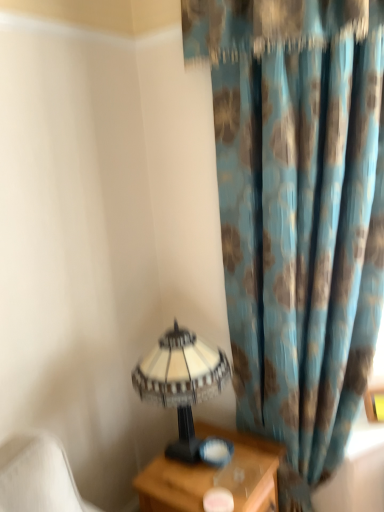
You are a GUI agent. You are given a task and a screenshot of the screen. Output one action in this format:
    pyautogui.click(x=<x>, y=<y>)
    Task: Click on the white textured lampshade at lower left
    
    Given the screenshot: What is the action you would take?
    pyautogui.click(x=181, y=382)

Find the location of a particular element. The width and height of the screenshot is (384, 512). wooden nightstand at lower right is located at coordinates (214, 476).

The image size is (384, 512). Find the location of `white textured lampshade at lower left`. white textured lampshade at lower left is located at coordinates (181, 382).

Is point (369, 401) positioned in front of point (353, 417)?

No.

How different are the orientations of yellow matte picture frame at right and blue floral fabric curtain at right in degrees?

They differ by 41.7 degrees in their facing directions.

Is yellow matte picture frame at right far away from blue floral fabric curtain at right?

No, yellow matte picture frame at right is not far away from blue floral fabric curtain at right.

Find the location of a particular element. This screenshot has width=384, height=512. curtain positioned vertically above the yellow matte picture frame at right (from a real-world perspective) is located at coordinates (298, 208).

How different are the orientations of wooden nightstand at lower right and white textured lampshade at lower left in degrees?

There is a 0.937-degree angle between the facing directions of wooden nightstand at lower right and white textured lampshade at lower left.

In terms of height, does wooden nightstand at lower right look taller or shorter compared to white textured lampshade at lower left?

In the image, wooden nightstand at lower right appears to be shorter than white textured lampshade at lower left.

Which point is more distant from viewer, (262,490) or (173,380)?

The point (262,490) is farther from the camera.

From a real-world perspective, is wooden nightstand at lower right located higher than white textured lampshade at lower left?

Actually, wooden nightstand at lower right is physically below white textured lampshade at lower left in the real world.

Which is more to the left, blue floral fabric curtain at right or wooden nightstand at lower right?

Positioned to the left is wooden nightstand at lower right.

Can you confirm if blue floral fabric curtain at right is thinner than wooden nightstand at lower right?

In fact, blue floral fabric curtain at right might be wider than wooden nightstand at lower right.

Does blue floral fabric curtain at right come behind wooden nightstand at lower right?

No, it is in front of wooden nightstand at lower right.

From a real-world perspective, is white textured lampshade at lower left physically located above or below blue floral fabric curtain at right?

white textured lampshade at lower left is situated lower than blue floral fabric curtain at right in the real world.

Where is `lamp directly beneath the blue floral fabric curtain at right (from a real-world perspective)`? The width and height of the screenshot is (384, 512). lamp directly beneath the blue floral fabric curtain at right (from a real-world perspective) is located at coordinates (181, 382).

Between white textured lampshade at lower left and blue floral fabric curtain at right, which one appears on the right side from the viewer's perspective?

From the viewer's perspective, blue floral fabric curtain at right appears more on the right side.

Consider the image. How different are the orientations of white textured lampshade at lower left and blue floral fabric curtain at right in degrees?

The facing directions of white textured lampshade at lower left and blue floral fabric curtain at right are 91.8 degrees apart.

From their relative heights in the image, would you say yellow matte picture frame at right is taller or shorter than white textured lampshade at lower left?

Considering their sizes, yellow matte picture frame at right has less height than white textured lampshade at lower left.

Can you confirm if yellow matte picture frame at right is positioned to the left of white textured lampshade at lower left?

No, yellow matte picture frame at right is not to the left of white textured lampshade at lower left.

Which is correct: yellow matte picture frame at right is inside white textured lampshade at lower left, or outside of it?

yellow matte picture frame at right is not enclosed by white textured lampshade at lower left.

From a real-world perspective, which is physically above, yellow matte picture frame at right or white textured lampshade at lower left?

In real-world perspective, white textured lampshade at lower left is above.

Between blue floral fabric curtain at right and yellow matte picture frame at right, which one is positioned behind?

yellow matte picture frame at right is further away from the camera.

From a real-world perspective, is blue floral fabric curtain at right over yellow matte picture frame at right?

Yes.

Is yellow matte picture frame at right at the back of blue floral fabric curtain at right?

That's right, blue floral fabric curtain at right is facing away from yellow matte picture frame at right.

Is blue floral fabric curtain at right surrounding yellow matte picture frame at right?

Yes, yellow matte picture frame at right is a part of blue floral fabric curtain at right.

Considering the positions of objects wooden nightstand at lower right and yellow matte picture frame at right in the image provided, who is more to the right, wooden nightstand at lower right or yellow matte picture frame at right?

From the viewer's perspective, yellow matte picture frame at right appears more on the right side.

Can you confirm if wooden nightstand at lower right is wider than yellow matte picture frame at right?

Correct, the width of wooden nightstand at lower right exceeds that of yellow matte picture frame at right.

From a real-world perspective, is wooden nightstand at lower right physically located above or below yellow matte picture frame at right?

Clearly, from a real-world perspective, wooden nightstand at lower right is below yellow matte picture frame at right.

You are a GUI agent. You are given a task and a screenshot of the screen. Output one action in this format:
    pyautogui.click(x=<x>, y=<y>)
    Task: Click on the picture frame lying above the wooden nightstand at lower right (from the image's perspective)
    
    Given the screenshot: What is the action you would take?
    pyautogui.click(x=374, y=403)

In the image, there is a blue floral fabric curtain at right. At what (x,y) coordinates should I click in order to perform the action: click on picture frame below it (from the image's perspective). Please return your answer as a coordinate pair (x, y). Looking at the image, I should click on (374, 403).

Identify the location of lamp located on the left of wooden nightstand at lower right. (181, 382).

Estimate the real-world distances between objects in this image. Which object is closer to wooden nightstand at lower right, yellow matte picture frame at right or blue floral fabric curtain at right?

blue floral fabric curtain at right is positioned closer to the anchor wooden nightstand at lower right.

In the scene shown: Considering their positions, is yellow matte picture frame at right positioned further to white textured lampshade at lower left than wooden nightstand at lower right?

yellow matte picture frame at right lies further to white textured lampshade at lower left than the other object.

Estimate the real-world distances between objects in this image. Which object is further from wooden nightstand at lower right, white textured lampshade at lower left or blue floral fabric curtain at right?

The object further to wooden nightstand at lower right is blue floral fabric curtain at right.

From the image, which object appears to be farther from wooden nightstand at lower right, white textured lampshade at lower left or yellow matte picture frame at right?

yellow matte picture frame at right.

From the picture: Considering their positions, is wooden nightstand at lower right positioned closer to yellow matte picture frame at right than blue floral fabric curtain at right?

The object closer to yellow matte picture frame at right is wooden nightstand at lower right.

Which object lies further to the anchor point yellow matte picture frame at right, blue floral fabric curtain at right or wooden nightstand at lower right?

blue floral fabric curtain at right.

Considering their positions, is white textured lampshade at lower left positioned closer to yellow matte picture frame at right than blue floral fabric curtain at right?

Among the two, white textured lampshade at lower left is located nearer to yellow matte picture frame at right.

Based on the photo, from the image, which object appears to be nearer to blue floral fabric curtain at right, white textured lampshade at lower left or yellow matte picture frame at right?

Based on the image, white textured lampshade at lower left appears to be nearer to blue floral fabric curtain at right.

This screenshot has width=384, height=512. Find the location of `nightstand between white textured lampshade at lower left and yellow matte picture frame at right from left to right`. nightstand between white textured lampshade at lower left and yellow matte picture frame at right from left to right is located at coordinates (214, 476).

At what (x,y) coordinates should I click in order to perform the action: click on curtain located between white textured lampshade at lower left and yellow matte picture frame at right in the left-right direction. Please return your answer as a coordinate pair (x, y). Image resolution: width=384 pixels, height=512 pixels. Looking at the image, I should click on (298, 208).

The width and height of the screenshot is (384, 512). Find the location of `picture frame between blue floral fabric curtain at right and wooden nightstand at lower right vertically`. picture frame between blue floral fabric curtain at right and wooden nightstand at lower right vertically is located at coordinates (374, 403).

Identify the location of lamp between blue floral fabric curtain at right and wooden nightstand at lower right in the up-down direction. (181, 382).